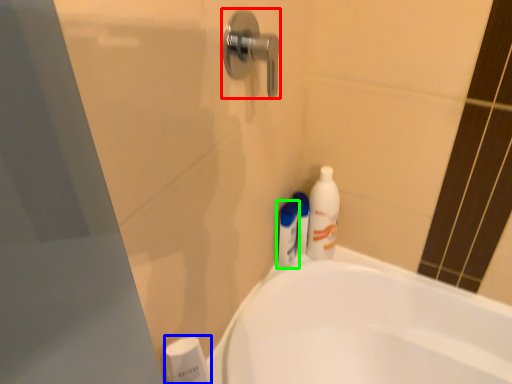
Question: Which object is positioned farthest from door handle (highlighted by a red box)? Select from toiletry (highlighted by a blue box) and toiletry (highlighted by a green box).

Choices:
 (A) toiletry
 (B) toiletry

Answer: (A)